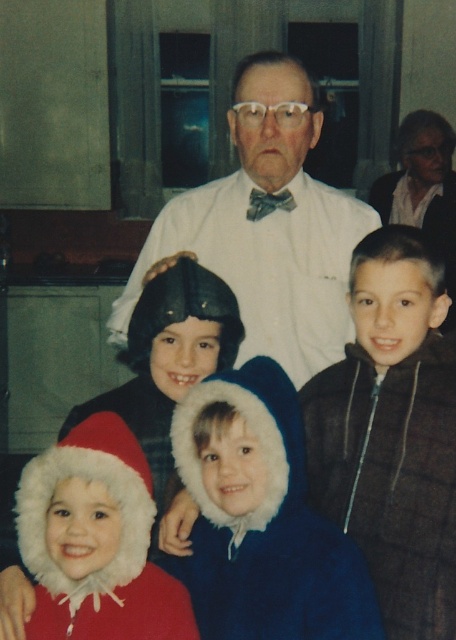
Is point (381, 608) in front of point (270, 189)?

Yes, point (381, 608) is closer to viewer.

What do you see at coordinates (393, 433) in the screenshot? I see `brown plaid jacket at right` at bounding box center [393, 433].

Which is behind, point (418, 413) or point (285, 349)?

Positioned behind is point (285, 349).

The height and width of the screenshot is (640, 456). What are the coordinates of `brown plaid jacket at right` in the screenshot? It's located at (393, 433).

Is point (238, 141) closer to viewer compared to point (72, 504)?

No, it is behind (72, 504).

From the picture: Who is more forward, (331, 189) or (48, 582)?

Point (48, 582) is in front.

Locate an element on the screen. The height and width of the screenshot is (640, 456). white textured shirt at center is located at coordinates (267, 227).

Who is higher up, fuzzy blue coat at center or fuzzy red santa hat at lower left?

fuzzy blue coat at center is above.

Does point (241, 429) come farther from viewer compared to point (119, 525)?

Yes, point (241, 429) is farther from viewer.

This screenshot has height=640, width=456. Identify the location of fuzzy blue coat at center. (262, 518).